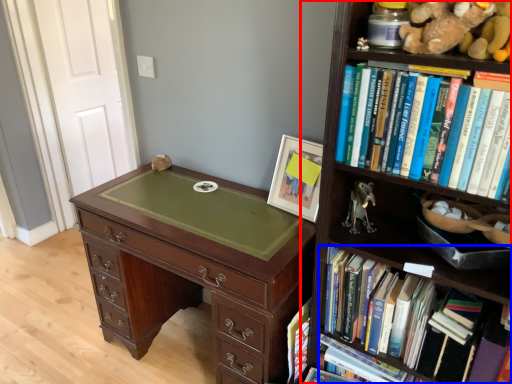
Question: Which point is closer to the camera, bookcase (highlighted by a red box) or book (highlighted by a blue box)?

Choices:
 (A) bookcase
 (B) book

Answer: (A)